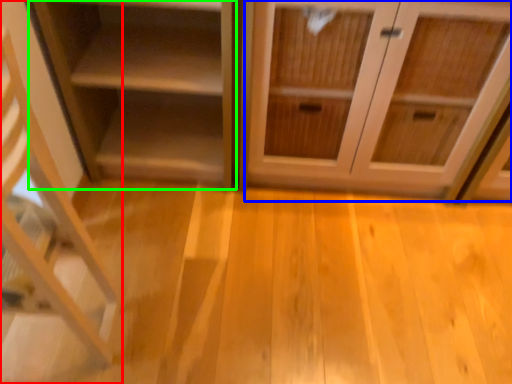
Question: Which object is the farthest from shelf (highlighted by a red box)? Choose among these: cabinetry (highlighted by a blue box) or shelf (highlighted by a green box).

Choices:
 (A) cabinetry
 (B) shelf

Answer: (A)